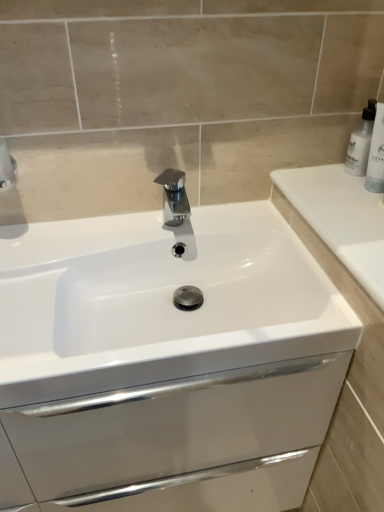
In order to click on white plastic bottle at upper right in this screenshot , I will do `click(361, 142)`.

Where is `polished chrome tap at center`? The height and width of the screenshot is (512, 384). polished chrome tap at center is located at coordinates (174, 196).

This screenshot has width=384, height=512. I want to click on white plastic bottle at upper right, so click(x=361, y=142).

Does white glossy bottle at upper right appear on the left side of white glossy sink at center?

No.

From a real-world perspective, is white glossy bottle at upper right physically below white glossy sink at center?

No, from a real-world perspective, white glossy bottle at upper right is not below white glossy sink at center.

Is white glossy bottle at upper right placed right next to white glossy sink at center?

They are not placed beside each other.

Considering the relative positions of white glossy sink at center and polished chrome tap at center in the image provided, is white glossy sink at center to the left or to the right of polished chrome tap at center?

white glossy sink at center is to the left of polished chrome tap at center.

Considering the relative sizes of white glossy sink at center and polished chrome tap at center in the image provided, is white glossy sink at center bigger than polished chrome tap at center?

Yes.

Is the depth of white glossy sink at center less than that of polished chrome tap at center?

Yes.

Considering the sizes of white glossy sink at center and polished chrome tap at center in the image, is white glossy sink at center wider or thinner than polished chrome tap at center?

Clearly, white glossy sink at center has more width compared to polished chrome tap at center.

Is polished chrome tap at center surrounding white glossy sink at center?

That's incorrect, white glossy sink at center is not inside polished chrome tap at center.

From the picture: Is polished chrome tap at center to the left or to the right of white glossy sink at center in the image?

Clearly, polished chrome tap at center is on the right of white glossy sink at center in the image.

From the image's perspective, is polished chrome tap at center above or below white glossy sink at center?

polished chrome tap at center is situated higher than white glossy sink at center in the image.

Is polished chrome tap at center taller or shorter than white glossy sink at center?

polished chrome tap at center is shorter than white glossy sink at center.

Based on the photo, from the image's perspective, relative to white glossy sink at center, is white plastic bottle at upper right above or below?

white plastic bottle at upper right is situated higher than white glossy sink at center in the image.

Which is in front, point (360, 138) or point (14, 269)?

Positioned in front is point (14, 269).

Is white plastic bottle at upper right wider or thinner than white glossy sink at center?

white plastic bottle at upper right is thinner than white glossy sink at center.

Considering the sizes of objects white plastic bottle at upper right and polished chrome tap at center in the image provided, who is wider, white plastic bottle at upper right or polished chrome tap at center?

With larger width is polished chrome tap at center.

From a real-world perspective, who is located lower, white plastic bottle at upper right or polished chrome tap at center?

In real-world perspective, polished chrome tap at center is lower.

Measure the distance from white plastic bottle at upper right to polished chrome tap at center.

white plastic bottle at upper right and polished chrome tap at center are 16.21 inches apart.

Image resolution: width=384 pixels, height=512 pixels. I want to click on tap that is under the white plastic bottle at upper right (from a real-world perspective), so click(x=174, y=196).

Considering the relative sizes of white glossy bottle at upper right and white plastic bottle at upper right in the image provided, is white glossy bottle at upper right thinner than white plastic bottle at upper right?

Yes, white glossy bottle at upper right is thinner than white plastic bottle at upper right.

Is white glossy bottle at upper right looking in the opposite direction of white plastic bottle at upper right?

No, white plastic bottle at upper right is not at the back of white glossy bottle at upper right.

Is white glossy bottle at upper right to the left or to the right of white plastic bottle at upper right in the image?

Clearly, white glossy bottle at upper right is on the right of white plastic bottle at upper right in the image.

Is white glossy bottle at upper right smaller than white plastic bottle at upper right?

Yes, white glossy bottle at upper right is smaller than white plastic bottle at upper right.

How different are the orientations of white glossy bottle at upper right and polished chrome tap at center in degrees?

white glossy bottle at upper right and polished chrome tap at center are facing 55.2 degrees away from each other.

Locate an element on the screen. This screenshot has height=512, width=384. tap that is behind the white glossy bottle at upper right is located at coordinates 174,196.

Is white glossy bottle at upper right positioned behind polished chrome tap at center?

That is False.

Looking at this image, from the image's perspective, which is below, white glossy bottle at upper right or polished chrome tap at center?

polished chrome tap at center appears lower in the image.

Where is `toiletry located on the right of white glossy sink at center`? The width and height of the screenshot is (384, 512). toiletry located on the right of white glossy sink at center is located at coordinates (376, 154).

What are the coordinates of `sink in front of the polished chrome tap at center` in the screenshot? It's located at (158, 301).

Considering their positions, is white glossy bottle at upper right positioned closer to white glossy sink at center than polished chrome tap at center?

polished chrome tap at center is closer to white glossy sink at center.

Based on their spatial positions, is white glossy sink at center or white glossy bottle at upper right further from white plastic bottle at upper right?

Based on the image, white glossy sink at center appears to be further to white plastic bottle at upper right.

Estimate the real-world distances between objects in this image. Which object is closer to white glossy sink at center, white plastic bottle at upper right or white glossy bottle at upper right?

Among the two, white glossy bottle at upper right is located nearer to white glossy sink at center.

Which object lies further to the anchor point white plastic bottle at upper right, white glossy bottle at upper right or polished chrome tap at center?

polished chrome tap at center is positioned further to the anchor white plastic bottle at upper right.

Which object lies nearer to the anchor point polished chrome tap at center, white glossy bottle at upper right or white plastic bottle at upper right?

white plastic bottle at upper right lies closer to polished chrome tap at center than the other object.

Looking at the image, which one is located closer to polished chrome tap at center, white glossy sink at center or white glossy bottle at upper right?

The object closer to polished chrome tap at center is white glossy sink at center.

When comparing their distances from polished chrome tap at center, does white plastic bottle at upper right or white glossy bottle at upper right seem further?

white glossy bottle at upper right is further to polished chrome tap at center.

Considering their positions, is white plastic bottle at upper right positioned further to white glossy sink at center than polished chrome tap at center?

Based on the image, white plastic bottle at upper right appears to be further to white glossy sink at center.

Where is `soap dispenser between polished chrome tap at center and white glossy bottle at upper right in the horizontal direction`? Image resolution: width=384 pixels, height=512 pixels. soap dispenser between polished chrome tap at center and white glossy bottle at upper right in the horizontal direction is located at coordinates (361, 142).

What are the coordinates of `tap between white glossy sink at center and white plastic bottle at upper right from left to right` in the screenshot? It's located at (174, 196).

Where is `soap dispenser located between white glossy sink at center and white glossy bottle at upper right in the left-right direction`? soap dispenser located between white glossy sink at center and white glossy bottle at upper right in the left-right direction is located at coordinates (361, 142).

You are a GUI agent. You are given a task and a screenshot of the screen. Output one action in this format:
    pyautogui.click(x=<x>, y=<y>)
    Task: Click on the tap between white glossy sink at center and white glossy bottle at upper right from left to right
    
    Given the screenshot: What is the action you would take?
    pyautogui.click(x=174, y=196)